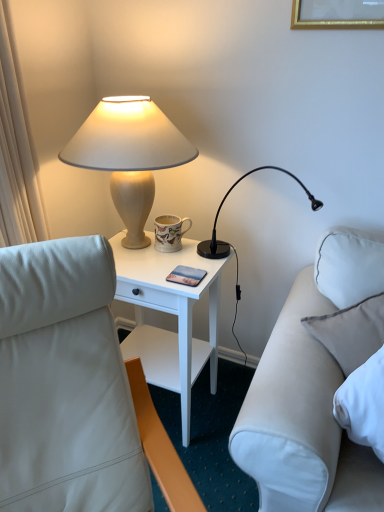
Question: From the image's perspective, is white leather studio couch at right positioned above or below black plastic desk lamp at upper right, the 2th lamp positioned from the left?

Choices:
 (A) above
 (B) below

Answer: (B)

Question: Choose the correct answer: Is white leather studio couch at right inside black plastic desk lamp at upper right, the 2th lamp positioned from the left, or outside it?

Choices:
 (A) outside
 (B) inside

Answer: (A)

Question: Which is farther from the black plastic desk lamp at upper right, acting as the 1th lamp starting from the right?

Choices:
 (A) white leather studio couch at right
 (B) white wood nightstand at center
 (C) matte beige lamp at upper left, the 2th lamp in the right-to-left sequence

Answer: (A)

Question: Which of these objects is positioned farthest from the white leather studio couch at right?

Choices:
 (A) black plastic desk lamp at upper right, acting as the 1th lamp starting from the right
 (B) matte beige lamp at upper left, the first lamp viewed from the left
 (C) white wood nightstand at center

Answer: (B)